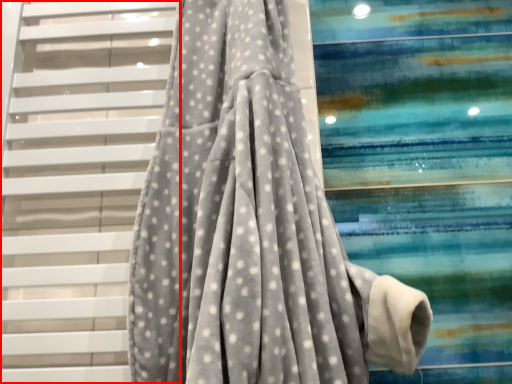
Question: In this image, where is stairs (annotated by the red box) located relative to curtain?

Choices:
 (A) left
 (B) right

Answer: (A)